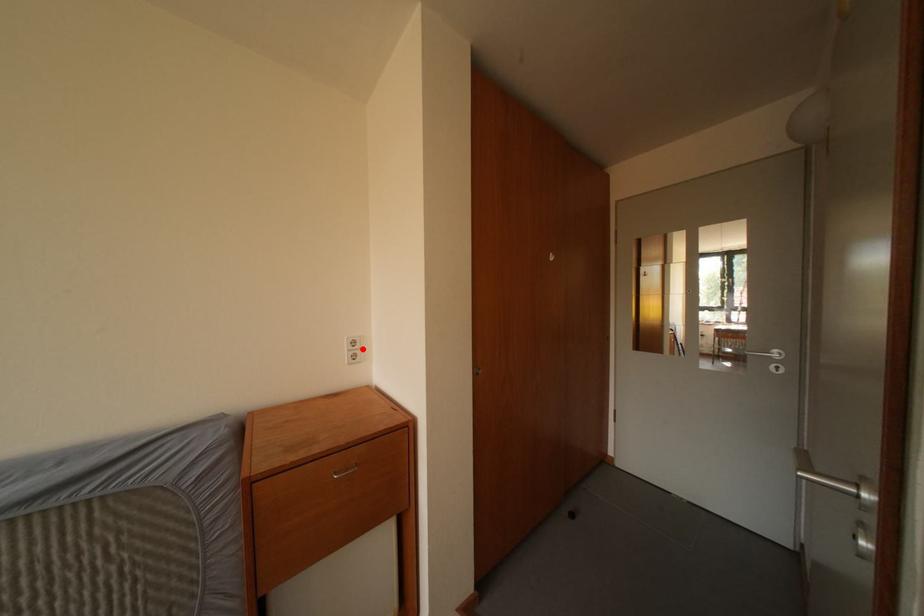
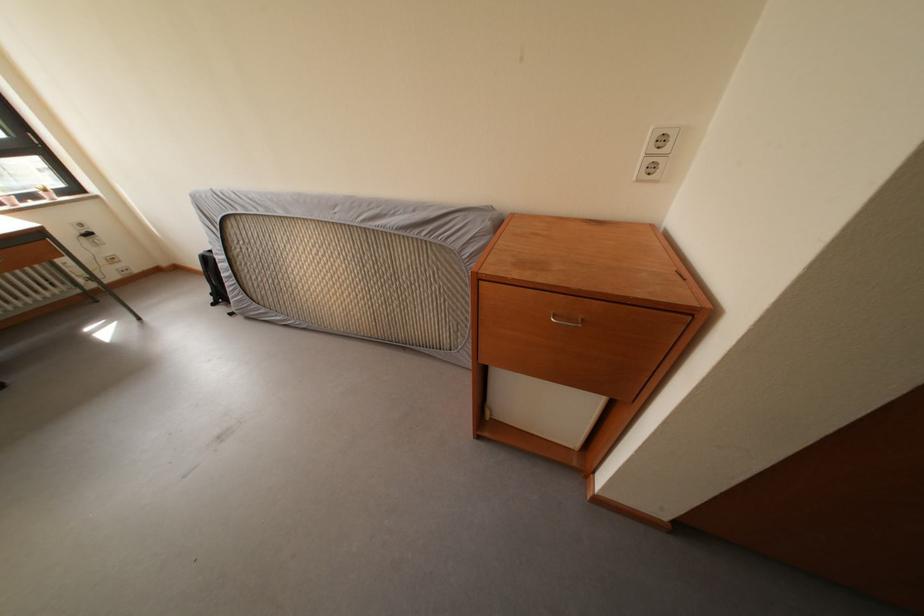
Question: I am providing you with two images of the same scene from different viewpoints. Given a red point in image1, look at the same physical point in image2. Is it:

Choices:
 (A) Closer to the viewpoint
 (B) Farther from the viewpoint

Answer: (A)